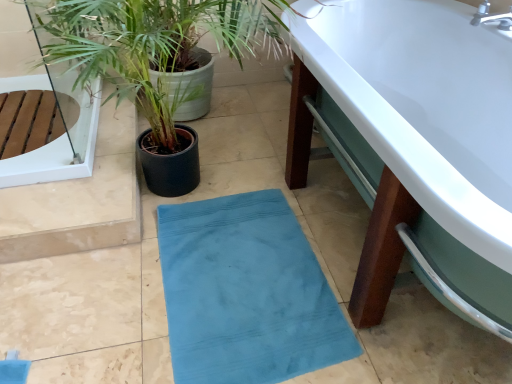
Question: Can you confirm if green leafy plant at left is positioned to the right of teal fabric bath mat at center?

Choices:
 (A) yes
 (B) no

Answer: (B)

Question: From the image's perspective, is green leafy plant at left above teal fabric bath mat at center?

Choices:
 (A) no
 (B) yes

Answer: (B)

Question: Considering the relative sizes of green leafy plant at left and teal fabric bath mat at center in the image provided, is green leafy plant at left taller than teal fabric bath mat at center?

Choices:
 (A) yes
 (B) no

Answer: (A)

Question: Considering the relative sizes of green leafy plant at left and teal fabric bath mat at center in the image provided, is green leafy plant at left thinner than teal fabric bath mat at center?

Choices:
 (A) yes
 (B) no

Answer: (B)

Question: Is green leafy plant at left completely or partially outside of teal fabric bath mat at center?

Choices:
 (A) no
 (B) yes

Answer: (B)

Question: Is white glossy bathtub at lower right in front of or behind transparent glass door at upper left in the image?

Choices:
 (A) behind
 (B) front

Answer: (B)

Question: From a real-world perspective, is white glossy bathtub at lower right positioned above or below transparent glass door at upper left?

Choices:
 (A) above
 (B) below

Answer: (A)

Question: From the image's perspective, is white glossy bathtub at lower right positioned above or below transparent glass door at upper left?

Choices:
 (A) above
 (B) below

Answer: (B)

Question: Based on their sizes in the image, would you say white glossy bathtub at lower right is bigger or smaller than transparent glass door at upper left?

Choices:
 (A) small
 (B) big

Answer: (B)

Question: Is teal fabric bath mat at center taller or shorter than white glossy bathtub at lower right?

Choices:
 (A) short
 (B) tall

Answer: (A)

Question: Looking at their shapes, would you say teal fabric bath mat at center is wider or thinner than white glossy bathtub at lower right?

Choices:
 (A) wide
 (B) thin

Answer: (B)

Question: In terms of size, does teal fabric bath mat at center appear bigger or smaller than white glossy bathtub at lower right?

Choices:
 (A) small
 (B) big

Answer: (A)

Question: Does point (265, 193) appear closer or farther from the camera than point (501, 316)?

Choices:
 (A) farther
 (B) closer

Answer: (A)

Question: From their relative heights in the image, would you say green leafy plant at left is taller or shorter than transparent glass door at upper left?

Choices:
 (A) tall
 (B) short

Answer: (A)

Question: Considering the positions of green leafy plant at left and transparent glass door at upper left in the image, is green leafy plant at left wider or thinner than transparent glass door at upper left?

Choices:
 (A) thin
 (B) wide

Answer: (A)